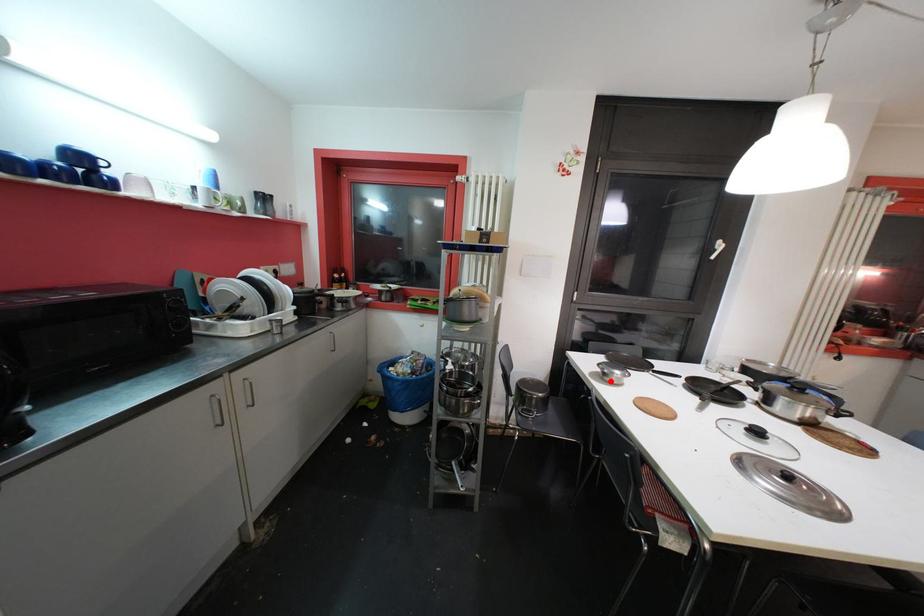
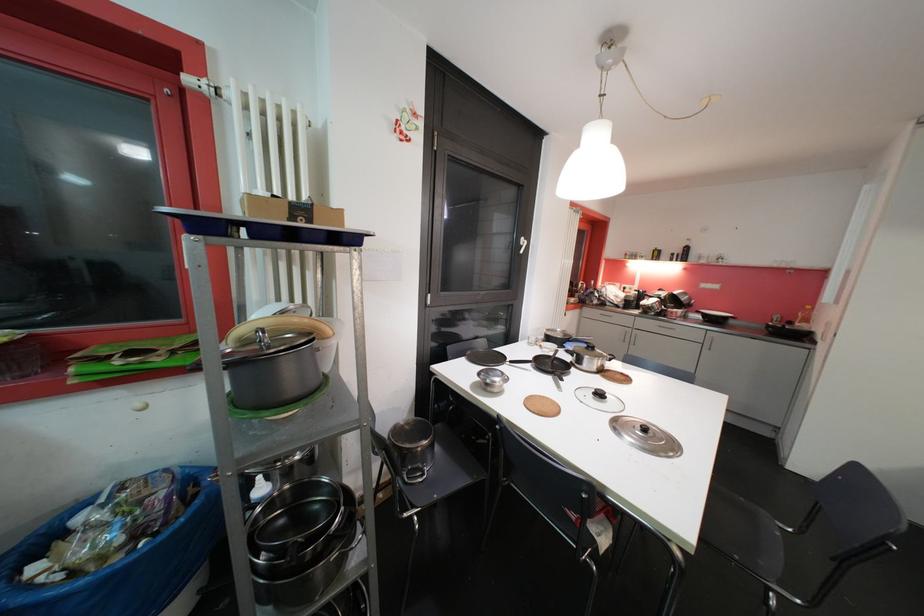
In the second image, find the point that corresponds to the highlighted location in the first image.

(493, 392)